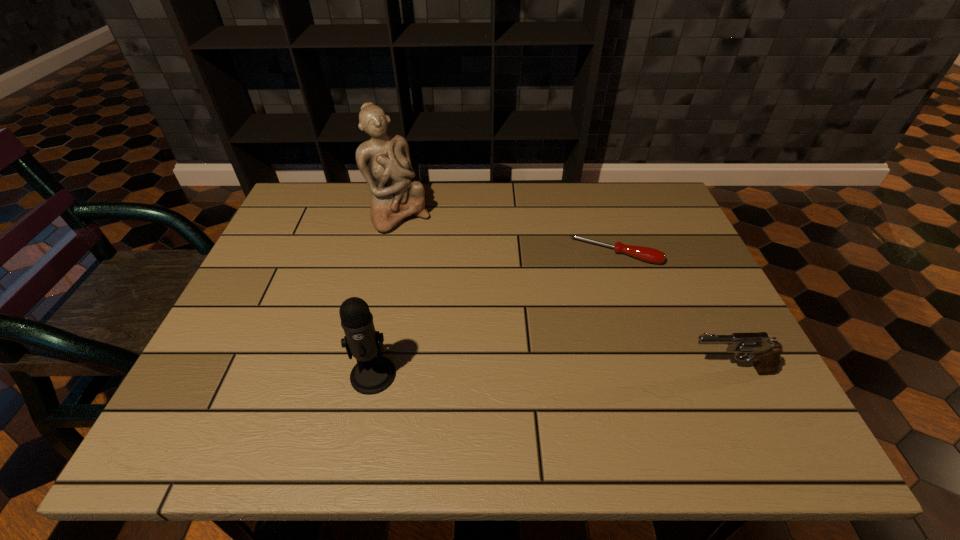
This screenshot has height=540, width=960. In order to click on screwdriver that is at the right edge in this screenshot , I will do `click(647, 254)`.

Where is `object that is at the near right corner`? object that is at the near right corner is located at coordinates (766, 354).

Locate an element on the screen. The height and width of the screenshot is (540, 960). vacant space at the far edge of the desktop is located at coordinates (430, 197).

In the image, there is a desktop. In order to click on free space at the near edge in this screenshot , I will do `click(595, 374)`.

Find the location of a particular element. vacant space at the left edge is located at coordinates (282, 285).

This screenshot has width=960, height=540. Find the location of `vacant space at the right edge of the desktop`. vacant space at the right edge of the desktop is located at coordinates (671, 275).

Image resolution: width=960 pixels, height=540 pixels. In the image, there is a desktop. What are the coordinates of `vacant space at the far left corner` in the screenshot? It's located at (286, 222).

Identify the location of vacant space at the far right corner of the desktop. The height and width of the screenshot is (540, 960). (667, 208).

Locate an element on the screen. Image resolution: width=960 pixels, height=540 pixels. free location at the near right corner is located at coordinates click(x=738, y=369).

Locate an element on the screen. The image size is (960, 540). vacant space that is in between the tallest object and the second shortest object is located at coordinates (564, 294).